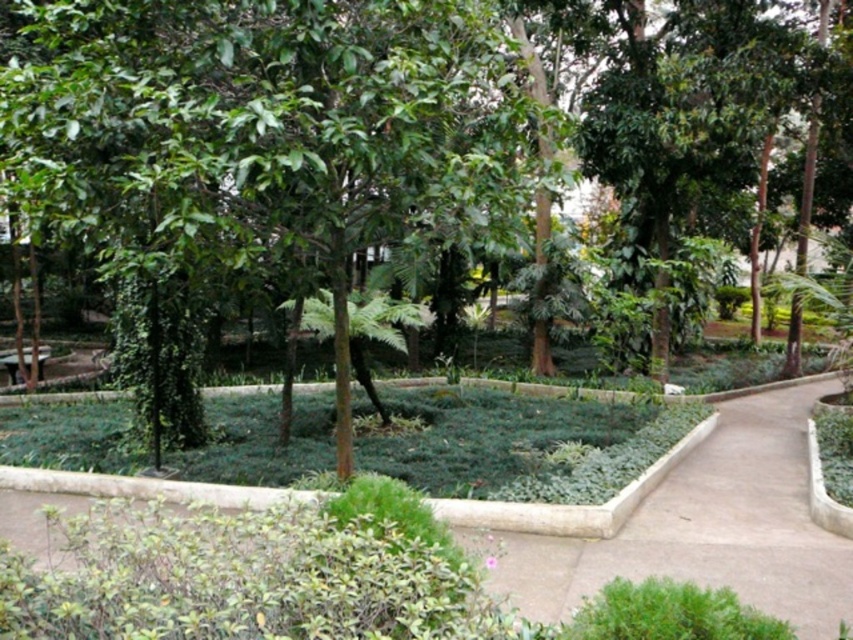
Who is more forward, (703, 522) or (38, 362)?

Point (703, 522)

Who is more distant from viewer, (747, 488) or (10, 358)?

The point (10, 358) is behind.

This screenshot has height=640, width=853. What do you see at coordinates (703, 528) in the screenshot?
I see `brown concrete path at center` at bounding box center [703, 528].

Image resolution: width=853 pixels, height=640 pixels. Identify the location of brown concrete path at center. (703, 528).